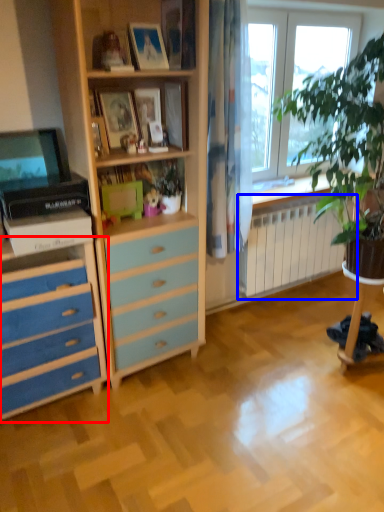
Question: Among these objects, which one is farthest to the camera, chest of drawers (highlighted by a red box) or radiator (highlighted by a blue box)?

Choices:
 (A) chest of drawers
 (B) radiator

Answer: (B)